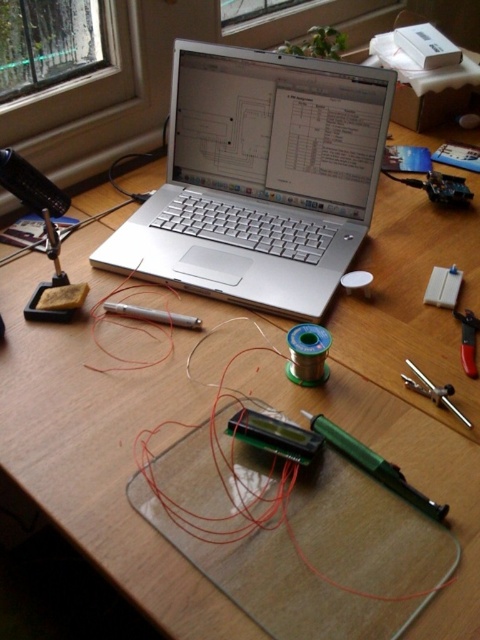
What do you see at coordinates (260, 179) in the screenshot? I see `silver metallic laptop at center` at bounding box center [260, 179].

Can you confirm if silver metallic laptop at center is smaller than metallic silver compass at right?

No.

Is point (385, 81) positioned behind point (444, 404)?

Yes, it is behind point (444, 404).

Image resolution: width=480 pixels, height=640 pixels. I want to click on silver metallic laptop at center, so click(260, 179).